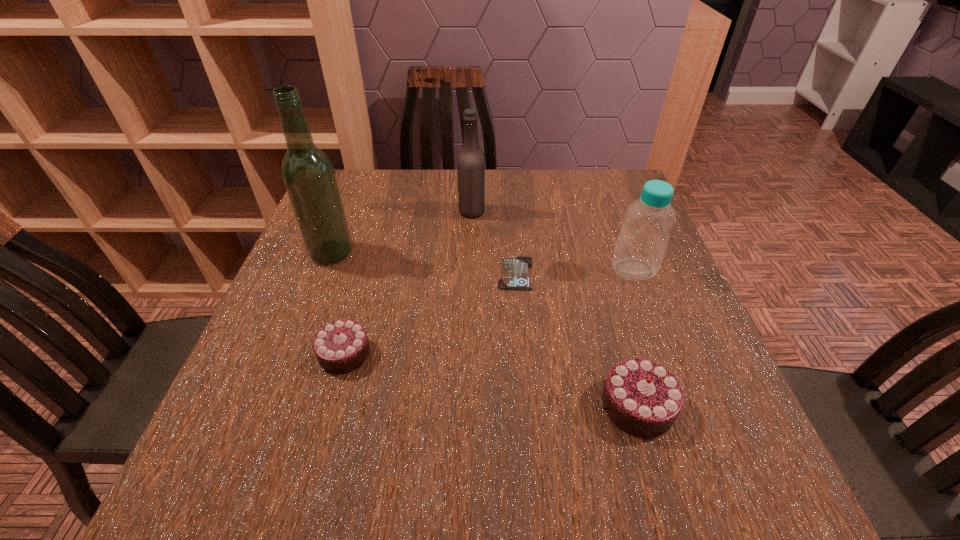
Locate an element on the screen. This screenshot has height=540, width=960. chocolate cake that is at the right edge is located at coordinates (642, 398).

Find the location of `bottle located in the right edge section of the desktop`. bottle located in the right edge section of the desktop is located at coordinates (641, 244).

Find the location of a particular element. This screenshot has height=540, width=960. object situated at the near right corner is located at coordinates (642, 398).

In order to click on vacant space at the far edge of the desktop in this screenshot , I will do `click(492, 198)`.

You are a GUI agent. You are given a task and a screenshot of the screen. Output one action in this format:
    pyautogui.click(x=<x>, y=<y>)
    Task: Click on the blank space at the near edge
    The width and height of the screenshot is (960, 540).
    Given the screenshot: What is the action you would take?
    pyautogui.click(x=591, y=427)

In the image, there is a desktop. Where is `vacant region at the left edge`? This screenshot has height=540, width=960. vacant region at the left edge is located at coordinates (300, 369).

This screenshot has width=960, height=540. Find the location of `vacant point at the right edge`. vacant point at the right edge is located at coordinates (598, 227).

Locate an element on the screen. Image resolution: width=960 pixels, height=540 pixels. free space at the far left corner is located at coordinates (370, 197).

You are a GUI agent. You are given a task and a screenshot of the screen. Output one action in this format:
    pyautogui.click(x=<x>, y=<y>)
    Task: Click on the vacant space at the near left corner
    
    Given the screenshot: What is the action you would take?
    pos(272,410)

The height and width of the screenshot is (540, 960). In the image, there is a desktop. Find the location of `vacant region at the far right corner`. vacant region at the far right corner is located at coordinates (616, 199).